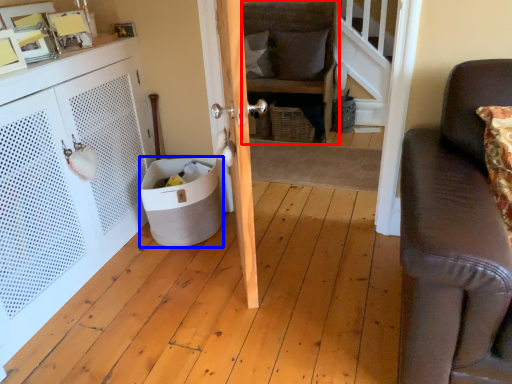
Question: Which of the following is the closest to the observer, chair (highlighted by a red box) or trash bin/can (highlighted by a blue box)?

Choices:
 (A) chair
 (B) trash bin/can

Answer: (B)